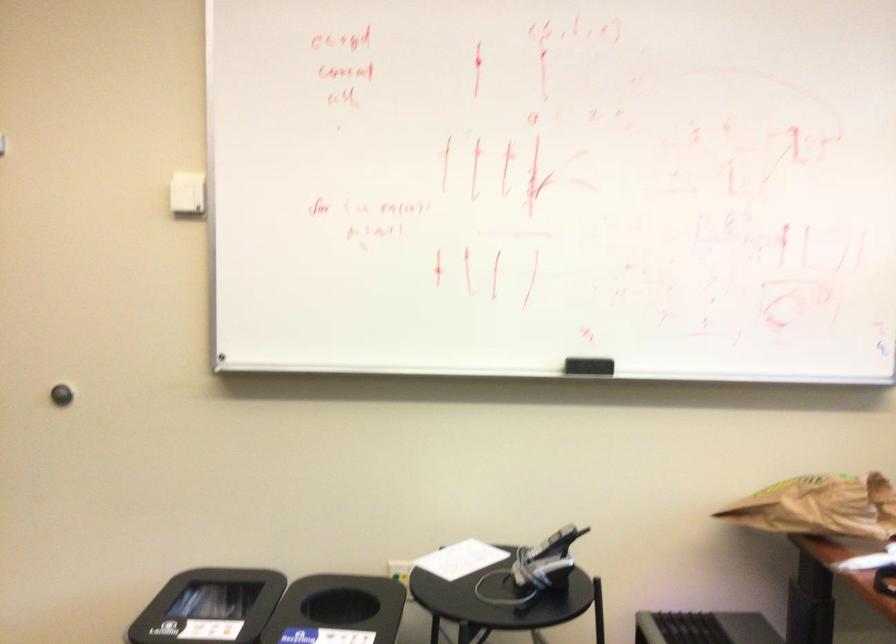
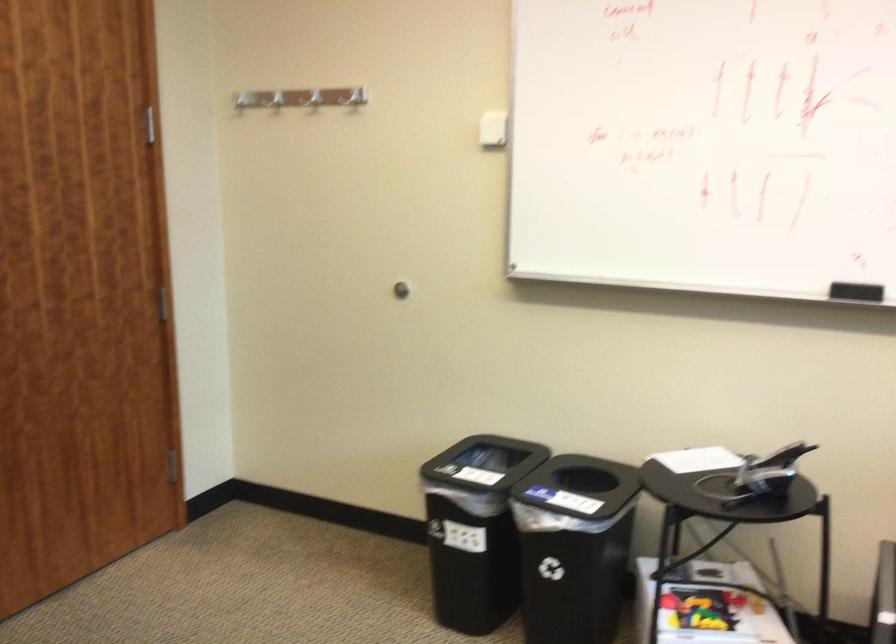
In the second image, find the point that corresponds to point (194, 184) in the first image.

(493, 129)